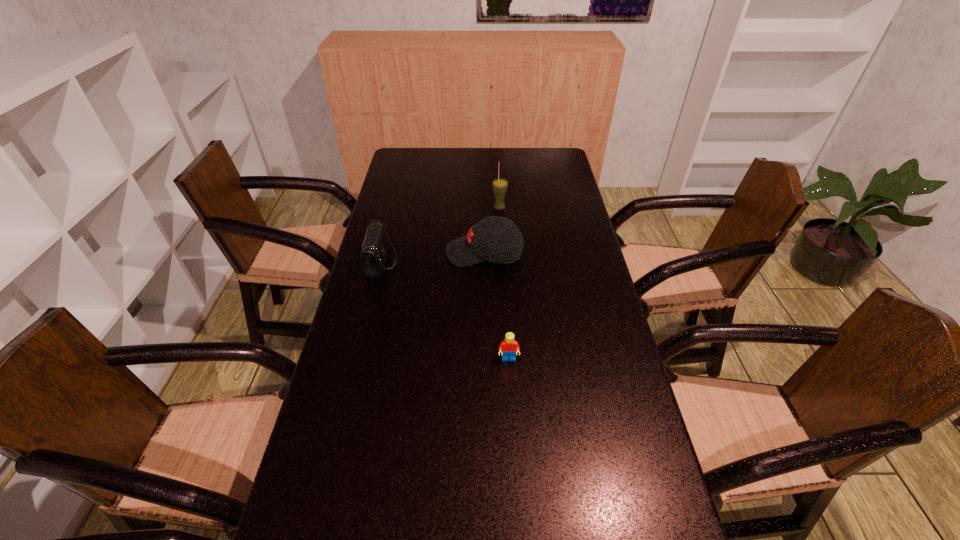
You are a GUI agent. You are given a task and a screenshot of the screen. Output one action in this format:
    pyautogui.click(x=<x>, y=<y>)
    Task: Click on the unoccupied area between the Lego and the tallest object
    
    Given the screenshot: What is the action you would take?
    pyautogui.click(x=504, y=284)

At what (x,y) coordinates should I click in order to perform the action: click on blank region between the nearest object and the third shortest object. Please return your answer as a coordinate pair (x, y). Looking at the image, I should click on (496, 306).

The image size is (960, 540). I want to click on vacant point located between the farthest object and the nearest object, so click(504, 284).

Locate which object is the closest to the Lego. Please provide its 2D coordinates. Your answer should be formatted as a tuple, i.e. [(x, y)], where the tuple contains the x and y coordinates of a point satisfying the conditions above.

[(481, 243)]

Where is `object that stands as the closest to the nearest object`? This screenshot has width=960, height=540. object that stands as the closest to the nearest object is located at coordinates (481, 243).

This screenshot has width=960, height=540. I want to click on blank area in the image that satisfies the following two spatial constraints: 1. on the front side of the tallest object; 2. on the front flap of the leftmost object, so 502,261.

This screenshot has height=540, width=960. I want to click on free region that satisfies the following two spatial constraints: 1. on the front side of the tallest object; 2. on the front-facing side of the baseball cap, so click(502, 253).